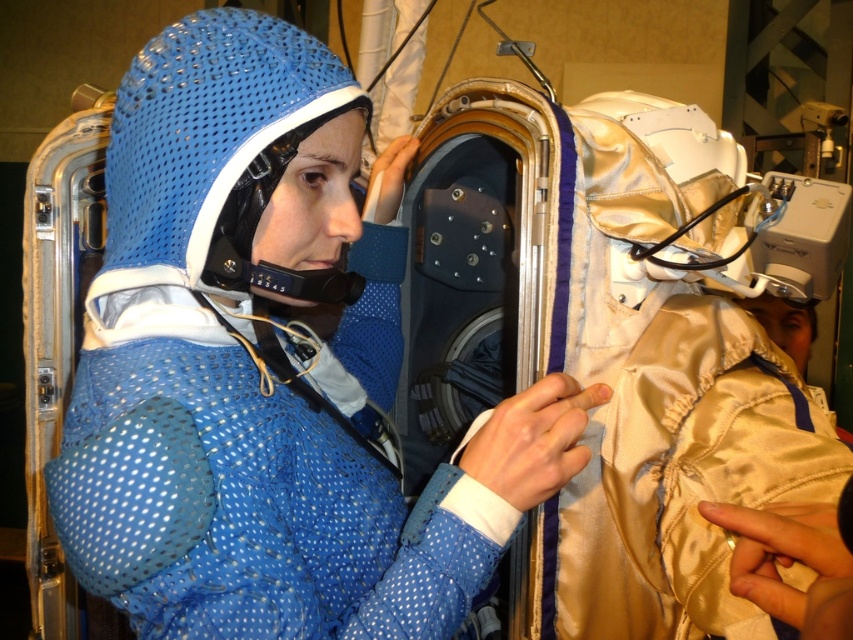
Is blue mesh suit at center to the right of blue mesh helmet at center from the viewer's perspective?

Correct, you'll find blue mesh suit at center to the right of blue mesh helmet at center.

What do you see at coordinates (267, 368) in the screenshot? This screenshot has height=640, width=853. I see `blue mesh suit at center` at bounding box center [267, 368].

You are a GUI agent. You are given a task and a screenshot of the screen. Output one action in this format:
    pyautogui.click(x=<x>, y=<y>)
    Task: Click on the blue mesh suit at center
    This screenshot has height=640, width=853.
    Given the screenshot: What is the action you would take?
    pyautogui.click(x=267, y=368)